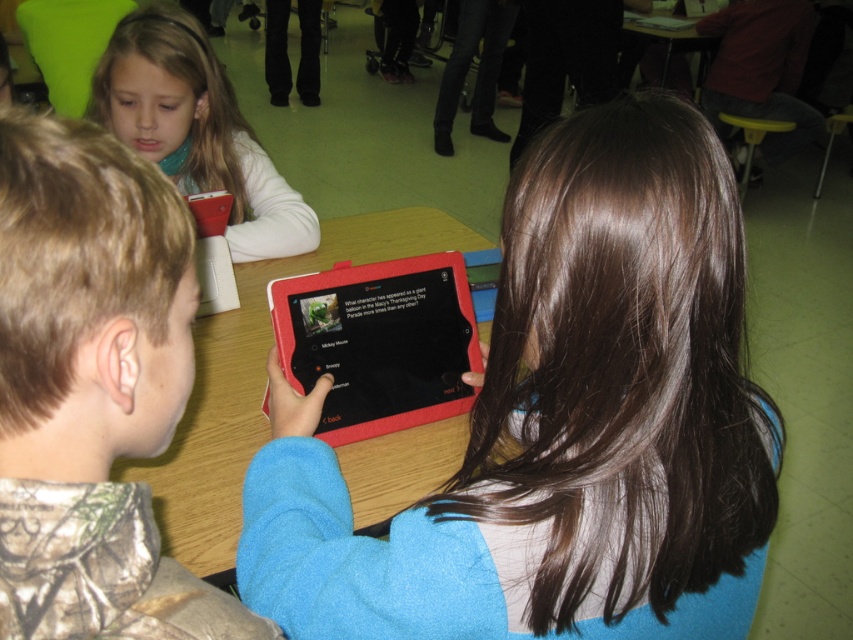
Does wooden table at center appear on the left side of rubberized black tablet at center?

Correct, you'll find wooden table at center to the left of rubberized black tablet at center.

Who is more forward, (212, 324) or (344, 323)?

Point (344, 323) is more forward.

Which is behind, point (378, 230) or point (376, 376)?

The point (378, 230) is more distant.

Identify the location of wooden table at center. Image resolution: width=853 pixels, height=640 pixels. (259, 384).

Which is below, matte black tablet at center or rubberized black tablet at center?

Positioned lower is matte black tablet at center.

You are a GUI agent. You are given a task and a screenshot of the screen. Output one action in this format:
    pyautogui.click(x=<x>, y=<y>)
    Task: Click on the matte black tablet at center
    Image resolution: width=853 pixels, height=640 pixels.
    Given the screenshot: What is the action you would take?
    pyautogui.click(x=561, y=422)

Who is more distant from viewer, (589, 168) or (22, 385)?

The point (589, 168) is behind.

Does matte black tablet at center have a lesser width compared to camouflage fabric shirt at lower left?

Incorrect, matte black tablet at center's width is not less than camouflage fabric shirt at lower left's.

Who is more distant from viewer, (532, 348) or (186, 276)?

Positioned behind is point (532, 348).

Locate an element on the screen. This screenshot has height=640, width=853. matte black tablet at center is located at coordinates (561, 422).